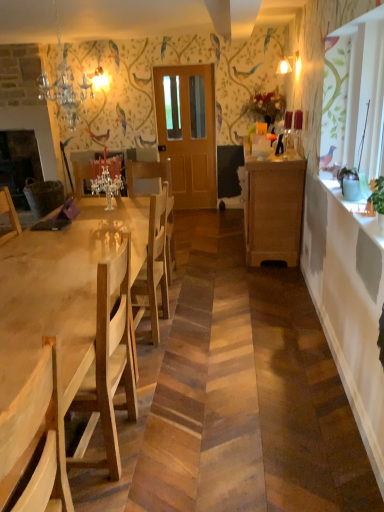
Question: Is crystal glass chandelier at upper left, positioned as the 1th lamp in front-to-back order, surrounding matte glass lampshade at upper center, which is the 2th lamp from bottom to top?

Choices:
 (A) no
 (B) yes

Answer: (A)

Question: From a real-world perspective, is crystal glass chandelier at upper left, which is the 1th lamp in left-to-right order, positioned under matte glass lampshade at upper center, the 1th lamp viewed from the top, based on gravity?

Choices:
 (A) yes
 (B) no

Answer: (A)

Question: Can we say crystal glass chandelier at upper left, which is the 1th lamp in left-to-right order, lies outside matte glass lampshade at upper center, the 1th lamp in the back-to-front sequence?

Choices:
 (A) no
 (B) yes

Answer: (B)

Question: Is crystal glass chandelier at upper left, which is counted as the 2th lamp, starting from the top, oriented away from matte glass lampshade at upper center, the 1th lamp viewed from the top?

Choices:
 (A) yes
 (B) no

Answer: (B)

Question: Is crystal glass chandelier at upper left, which is counted as the 2th lamp, starting from the top, at the left side of matte glass lampshade at upper center, arranged as the 1th lamp when viewed from the right?

Choices:
 (A) yes
 (B) no

Answer: (A)

Question: Is crystal glass chandelier at upper left, which is the 1th lamp in left-to-right order, smaller than matte glass lampshade at upper center, the 1th lamp in the back-to-front sequence?

Choices:
 (A) yes
 (B) no

Answer: (B)

Question: Is matte glass lampshade at upper center, the 1th lamp viewed from the top, not near wooden cabinet at right?

Choices:
 (A) yes
 (B) no

Answer: (A)

Question: From the image's perspective, does matte glass lampshade at upper center, the 2th lamp when ordered from left to right, appear higher than wooden cabinet at right?

Choices:
 (A) no
 (B) yes

Answer: (B)

Question: Can you confirm if matte glass lampshade at upper center, arranged as the 1th lamp when viewed from the right, is bigger than wooden cabinet at right?

Choices:
 (A) no
 (B) yes

Answer: (A)

Question: From a real-world perspective, is matte glass lampshade at upper center, the second lamp when ordered from front to back, physically above wooden cabinet at right?

Choices:
 (A) no
 (B) yes

Answer: (B)

Question: Can we say matte glass lampshade at upper center, arranged as the 1th lamp when viewed from the right, lies outside wooden cabinet at right?

Choices:
 (A) yes
 (B) no

Answer: (A)

Question: Could you tell me if matte glass lampshade at upper center, the 1th lamp in the back-to-front sequence, is turned towards wooden cabinet at right?

Choices:
 (A) no
 (B) yes

Answer: (A)

Question: Is crystal glass chandelier at upper left, the 1th lamp ordered from the bottom, oriented away from light wood table at center?

Choices:
 (A) yes
 (B) no

Answer: (B)